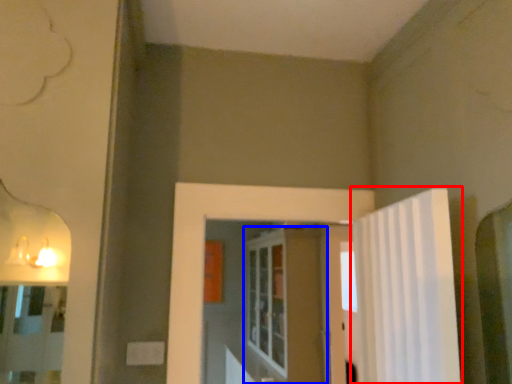
Question: Which point is further to the camera, shower curtain (highlighted by a red box) or screen door (highlighted by a blue box)?

Choices:
 (A) shower curtain
 (B) screen door

Answer: (B)